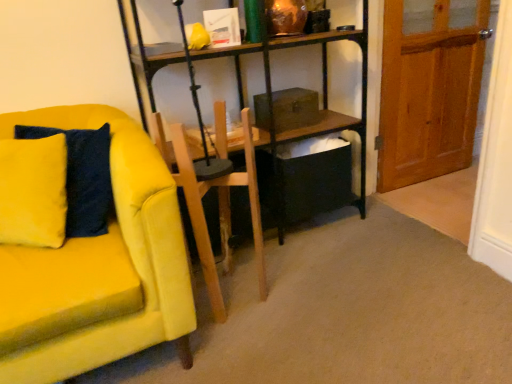
What do you see at coordinates (98, 268) in the screenshot?
I see `velvet yellow couch at left` at bounding box center [98, 268].

This screenshot has width=512, height=384. I want to click on wooden armchair at center, so coord(219,212).

The image size is (512, 384). What do you see at coordinates (219, 212) in the screenshot? I see `wooden armchair at center` at bounding box center [219, 212].

Where is `velvet yellow couch at left`? This screenshot has height=384, width=512. velvet yellow couch at left is located at coordinates (98, 268).

At what (x,y) coordinates should I click in order to perform the action: click on armchair on the right of velvet yellow pillow at left. Please return your answer as a coordinate pair (x, y). The width and height of the screenshot is (512, 384). Looking at the image, I should click on (219, 212).

Based on the photo, is wooden armchair at center taller than velvet yellow pillow at left?

Correct, wooden armchair at center is much taller as velvet yellow pillow at left.

Is the position of wooden armchair at center less distant than that of velvet yellow pillow at left?

No, wooden armchair at center is behind velvet yellow pillow at left.

Is wooden armchair at center thinner than velvet yellow pillow at left?

No.

Can you tell me how much wooden armchair at center and wooden at right differ in facing direction?

The angle between the facing direction of wooden armchair at center and the facing direction of wooden at right is 99.2 degrees.

Are wooden armchair at center and wooden at right located far from each other?

Yes, wooden armchair at center and wooden at right are located far from each other.

From the image's perspective, is wooden armchair at center on top of wooden at right?

Incorrect, from the image's perspective, wooden armchair at center is lower than wooden at right.

Does wooden armchair at center have a lesser width compared to wooden at right?

No, wooden armchair at center is not thinner than wooden at right.

From the image's perspective, is wooden at right on top of wooden armchair at center?

Correct, wooden at right appears higher than wooden armchair at center in the image.

Are wooden at right and wooden armchair at center far apart?

wooden at right is far away from wooden armchair at center.

Between wooden at right and wooden armchair at center, which one has more height?

wooden at right.

Does wooden at right have a smaller size compared to wooden armchair at center?

Incorrect, wooden at right is not smaller in size than wooden armchair at center.

Does velvet yellow pillow at left appear on the right side of velvet yellow couch at left?

Incorrect, velvet yellow pillow at left is not on the right side of velvet yellow couch at left.

Considering the sizes of objects velvet yellow pillow at left and velvet yellow couch at left in the image provided, who is smaller, velvet yellow pillow at left or velvet yellow couch at left?

Smaller between the two is velvet yellow pillow at left.

From the image's perspective, between velvet yellow pillow at left and velvet yellow couch at left, who is located below?

velvet yellow couch at left.

Where is `chair below the velvet yellow pillow at left (from a real-world perspective)`? chair below the velvet yellow pillow at left (from a real-world perspective) is located at coordinates (98, 268).

Considering the relative sizes of velvet yellow couch at left and wooden at right in the image provided, is velvet yellow couch at left taller than wooden at right?

Incorrect, the height of velvet yellow couch at left is not larger of that of wooden at right.

Identify the location of chair located on the left of wooden at right. (98, 268).

Which is behind, point (41, 315) or point (395, 138)?

The point (395, 138) is more distant.

In the scene shown: From a real-world perspective, is velvet yellow couch at left under wooden at right?

Yes.

Consider the image. Is wooden at right at the back of velvet yellow pillow at left?

No, velvet yellow pillow at left is not facing the opposite direction of wooden at right.

Is velvet yellow pillow at left spatially inside wooden at right, or outside of it?

velvet yellow pillow at left cannot be found inside wooden at right.

Does velvet yellow pillow at left have a greater width compared to wooden at right?

Indeed, velvet yellow pillow at left has a greater width compared to wooden at right.

Which is closer to the camera, (x=111, y=209) or (x=458, y=29)?

Point (x=111, y=209) is closer to the camera than point (x=458, y=29).

Does velvet yellow pillow at left have a larger size compared to wooden armchair at center?

No.

Is velvet yellow pillow at left closer to the viewer compared to wooden armchair at center?

Yes, it is.

Can you confirm if velvet yellow pillow at left is thinner than wooden armchair at center?

Yes.

From a real-world perspective, is velvet yellow pillow at left under wooden armchair at center?

No, from a real-world perspective, velvet yellow pillow at left is not below wooden armchair at center.

Where is `pillow on the left of wooden armchair at center`? pillow on the left of wooden armchair at center is located at coordinates (83, 177).

Locate an element on the screen. The height and width of the screenshot is (384, 512). door on the right of wooden armchair at center is located at coordinates (429, 88).

Estimate the real-world distances between objects in this image. Which object is closer to velvet yellow couch at left, velvet yellow pillow at left or wooden armchair at center?

Based on the image, velvet yellow pillow at left appears to be nearer to velvet yellow couch at left.

Based on their spatial positions, is velvet yellow couch at left or wooden at right further from velvet yellow pillow at left?

The object further to velvet yellow pillow at left is wooden at right.

Which object lies further to the anchor point wooden armchair at center, velvet yellow couch at left or velvet yellow pillow at left?

velvet yellow pillow at left is further to wooden armchair at center.

From the image, which object appears to be farther from wooden at right, velvet yellow pillow at left or wooden armchair at center?

velvet yellow pillow at left.

From the image, which object appears to be nearer to wooden at right, wooden armchair at center or velvet yellow couch at left?

wooden armchair at center lies closer to wooden at right than the other object.

Considering their positions, is velvet yellow pillow at left positioned further to wooden armchair at center than wooden at right?

Among the two, wooden at right is located further to wooden armchair at center.

Based on the photo, based on their spatial positions, is velvet yellow pillow at left or velvet yellow couch at left further from wooden at right?

velvet yellow pillow at left.

Based on their spatial positions, is wooden armchair at center or wooden at right closer to velvet yellow couch at left?

wooden armchair at center lies closer to velvet yellow couch at left than the other object.

The height and width of the screenshot is (384, 512). Identify the location of chair between velvet yellow pillow at left and wooden at right from left to right. (98, 268).

I want to click on armchair situated between velvet yellow couch at left and wooden at right from left to right, so click(219, 212).

At what (x,y) coordinates should I click in order to perform the action: click on chair between velvet yellow pillow at left and wooden armchair at center from left to right. Please return your answer as a coordinate pair (x, y). Looking at the image, I should click on (98, 268).

In order to click on armchair situated between velvet yellow pillow at left and wooden at right from left to right in this screenshot , I will do `click(219, 212)`.